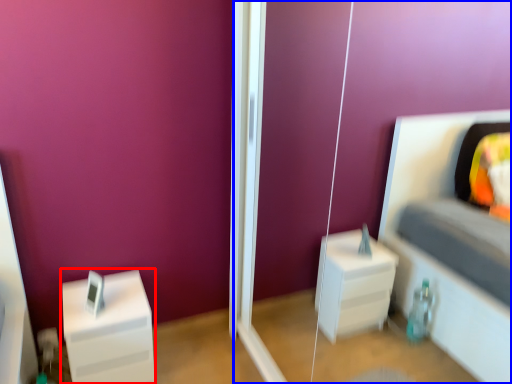
Question: Which object appears closest to the camera in this image, furniture (highlighted by a red box) or glass door (highlighted by a blue box)?

Choices:
 (A) furniture
 (B) glass door

Answer: (B)